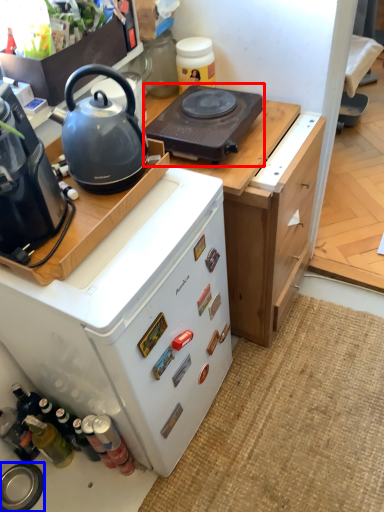
Question: Which object appears closest to the camera in this image, gas stove (highlighted by a red box) or kitchen appliance (highlighted by a blue box)?

Choices:
 (A) gas stove
 (B) kitchen appliance

Answer: (A)